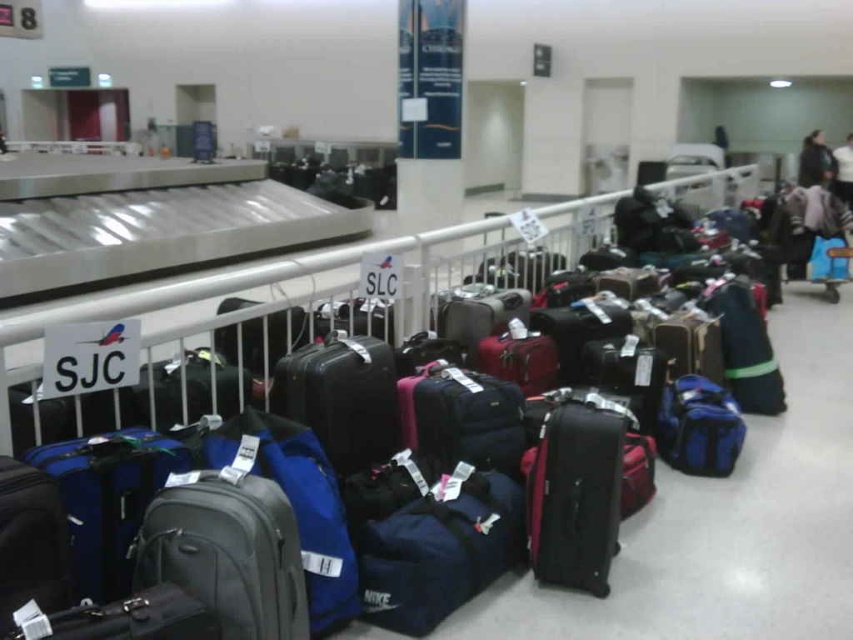
Question: Which object is the farthest from the matte black suitcase at center?

Choices:
 (A) blue fabric duffel at center
 (B) metallic silver luggage carousel at center

Answer: (B)

Question: Which point is closer to the camera?

Choices:
 (A) 699,189
 (B) 558,554
 (C) 675,410

Answer: (B)

Question: Is metallic silver luggage carousel at center smaller than blue fabric duffel at center?

Choices:
 (A) no
 (B) yes

Answer: (A)

Question: Which point is farther to the camera?

Choices:
 (A) metallic silver luggage carousel at center
 (B) blue fabric duffel at center

Answer: (B)

Question: Does metallic silver luggage carousel at center appear on the right side of blue fabric duffel at center?

Choices:
 (A) yes
 (B) no

Answer: (B)

Question: Does matte black suitcase at center have a larger size compared to blue fabric duffel at center?

Choices:
 (A) no
 (B) yes

Answer: (B)